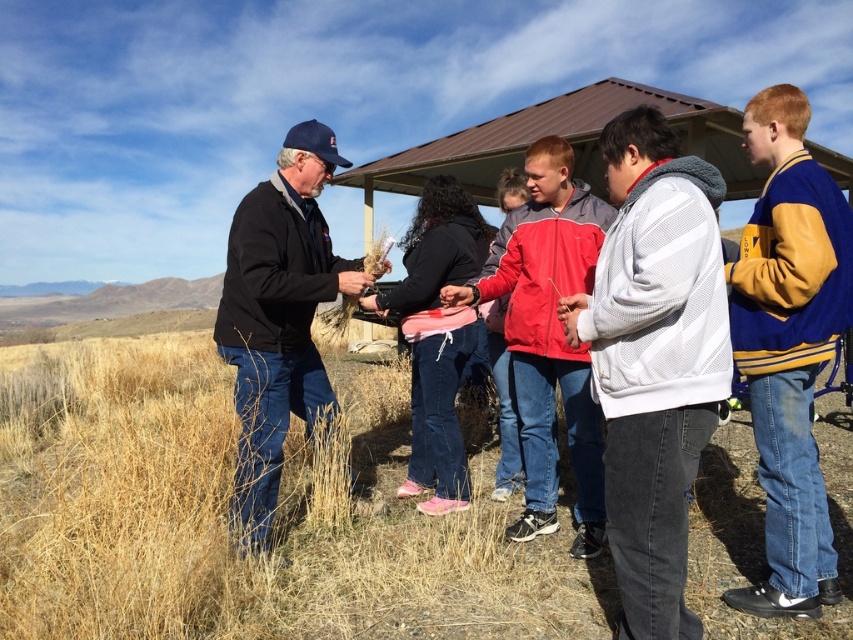
Question: Does black jacket at center have a greater width compared to red jacket at center?

Choices:
 (A) yes
 (B) no

Answer: (B)

Question: Which of these objects is positioned closest to the black jacket at center?

Choices:
 (A) red jacket at center
 (B) dry grass at center
 (C) blue and yellow varsity jacket at right
 (D) white mesh jacket at center

Answer: (A)

Question: Which object appears closest to the camera in this image?

Choices:
 (A) blue and yellow varsity jacket at right
 (B) black jacket at center

Answer: (A)

Question: Does blue and yellow varsity jacket at right come behind black jacket at center?

Choices:
 (A) yes
 (B) no

Answer: (B)

Question: Which point appears closest to the camera in this image?

Choices:
 (A) (625, 545)
 (B) (259, 621)
 (C) (318, 376)
 (D) (486, 275)

Answer: (A)

Question: Can you confirm if white mesh jacket at center is positioned to the left of black jacket at center?

Choices:
 (A) yes
 (B) no

Answer: (B)